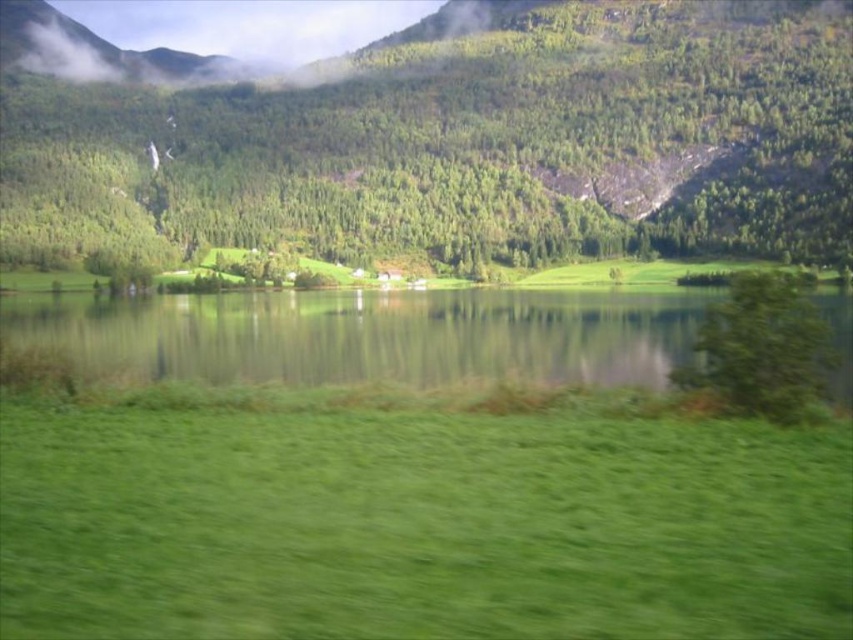
You are standing in the middle of the green field and see the green leafy tree at center and the green leafy tree at right. Which tree is taller?

The green leafy tree at center is taller than the green leafy tree at right.